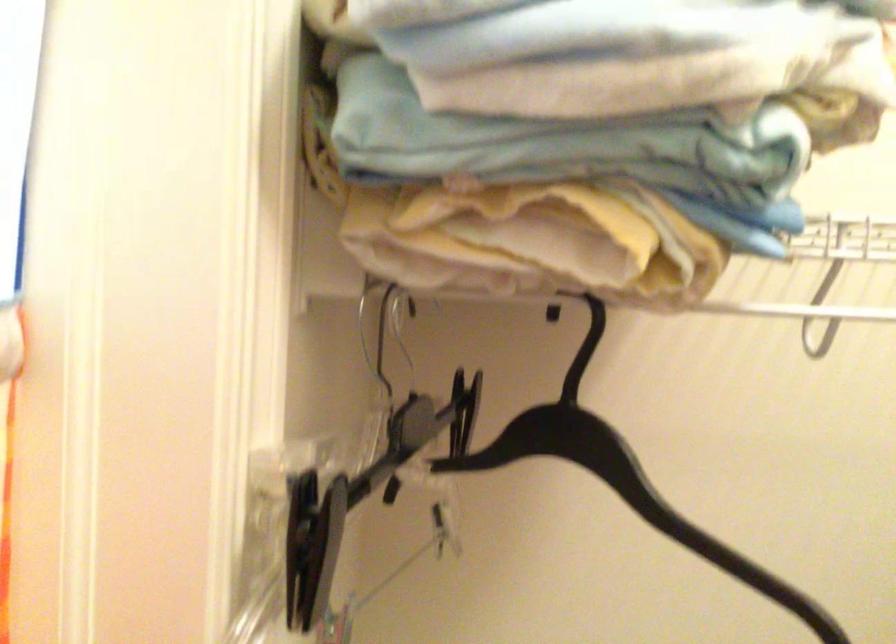
The height and width of the screenshot is (644, 896). I want to click on black plastic hanger, so click(624, 478).